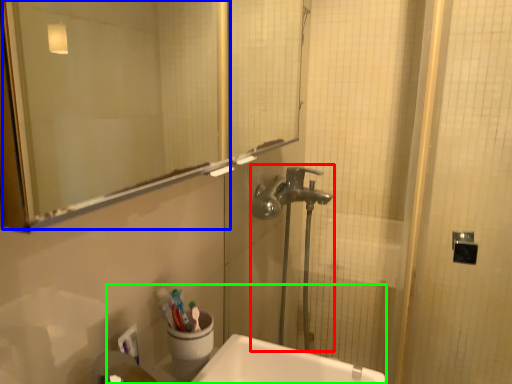
Question: Which object is positioned closest to plumbing fixture (highlighted by a red box)? Select from mirror (highlighted by a blue box) and sink (highlighted by a green box).

Choices:
 (A) mirror
 (B) sink

Answer: (B)